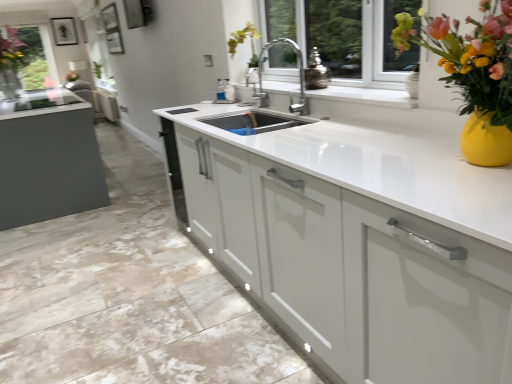
Question: Is vibrant ceramic vase at upper right situated inside white glossy cabinet at center, positioned as the first cabinetry in bottom-to-top order, or outside?

Choices:
 (A) outside
 (B) inside

Answer: (A)

Question: Is vibrant ceramic vase at upper right taller or shorter than white glossy cabinet at center, marked as the first cabinetry in a front-to-back arrangement?

Choices:
 (A) short
 (B) tall

Answer: (B)

Question: Which object is positioned farthest from the white glossy cabinet at center, the 2th cabinetry from the back?

Choices:
 (A) transparent glass window at upper left
 (B) white glossy cabinet at center, the first cabinetry viewed from the back
 (C) vibrant ceramic vase at upper right

Answer: (A)

Question: Considering the real-world distances, which object is closest to the white glossy cabinet at center, which is the second cabinetry from bottom to top?

Choices:
 (A) transparent glass window at upper left
 (B) vibrant ceramic vase at upper right
 (C) white glossy cabinet at center, the second cabinetry viewed from the top

Answer: (A)